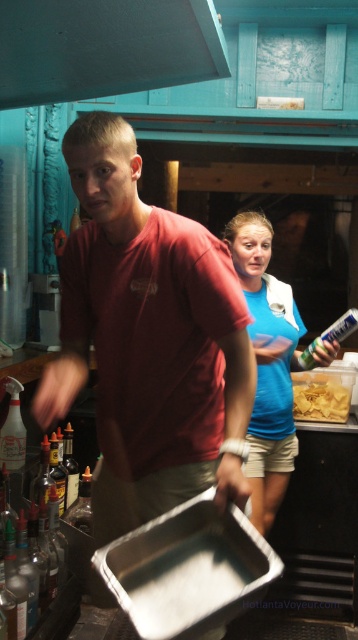
Question: Where is clear glass bottle at left located in relation to translucent glass bottle at lower left in the image?

Choices:
 (A) below
 (B) above

Answer: (A)

Question: Which object appears farthest from the camera in this image?

Choices:
 (A) clear glass bottle at left
 (B) matte red shirt at center

Answer: (A)

Question: Among these points, which one is nearest to the camera?

Choices:
 (A) (x=152, y=67)
 (B) (x=341, y=419)
 (C) (x=60, y=360)

Answer: (C)

Question: Can you confirm if yellow crispy chips at center is thinner than clear glass bottle at left?

Choices:
 (A) yes
 (B) no

Answer: (B)

Question: Based on their relative distances, which object is nearer to the clear glass bottle at left?

Choices:
 (A) translucent plastic bottle at left
 (B) yellow crispy chips at center
 (C) translucent glass bottle at lower left

Answer: (C)

Question: Is blue cotton shirt at center thinner than translucent plastic bottle at left?

Choices:
 (A) no
 (B) yes

Answer: (A)